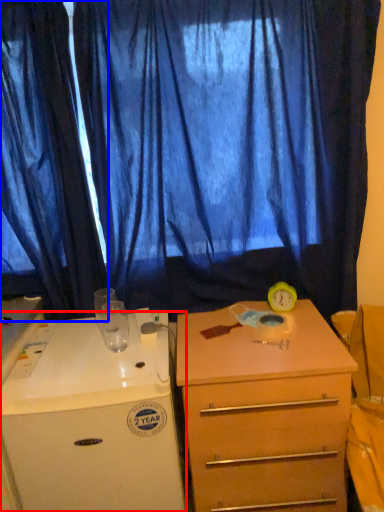
Question: Which point is further to the camera, desk (highlighted by a red box) or curtain (highlighted by a blue box)?

Choices:
 (A) desk
 (B) curtain

Answer: (B)